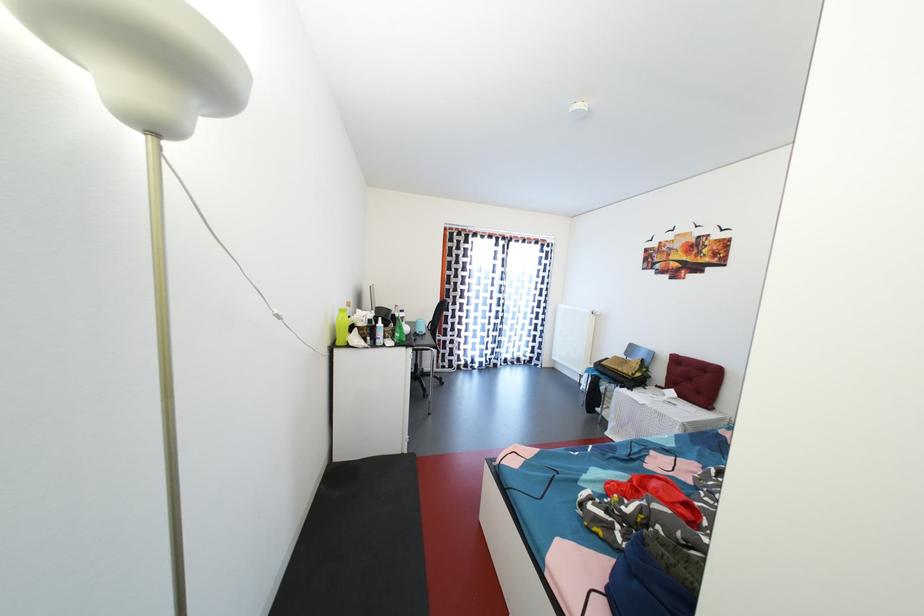
Where would you press the white cord switch? Please return your answer as a coordinate pair (x, y).

(276, 314)